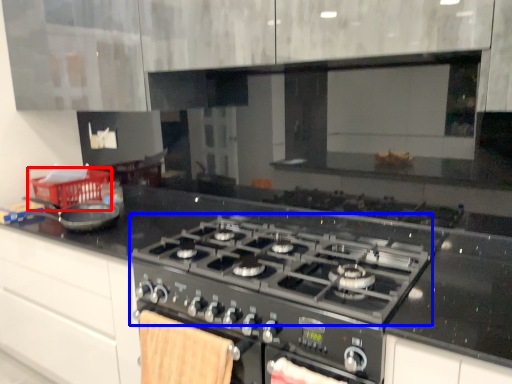
Question: Which of the following is the closest to the observer, basket (highlighted by a red box) or gas stove (highlighted by a blue box)?

Choices:
 (A) basket
 (B) gas stove

Answer: (B)